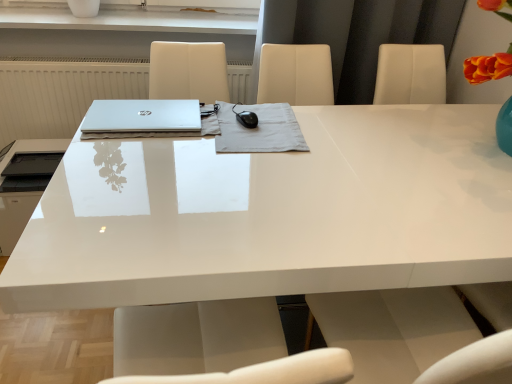
Where is `space that is in front of sleek silver laptop at center`? This screenshot has width=512, height=384. space that is in front of sleek silver laptop at center is located at coordinates (135, 157).